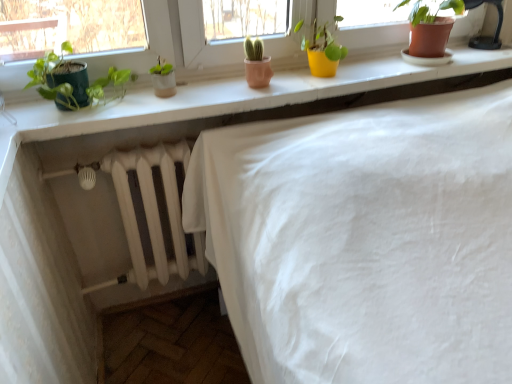
Where is `vacant space underneath yellow matte pot at upper center, which is the second houseplant in right-to-left order (from a real-world perspective)`? The image size is (512, 384). vacant space underneath yellow matte pot at upper center, which is the second houseplant in right-to-left order (from a real-world perspective) is located at coordinates coord(320,78).